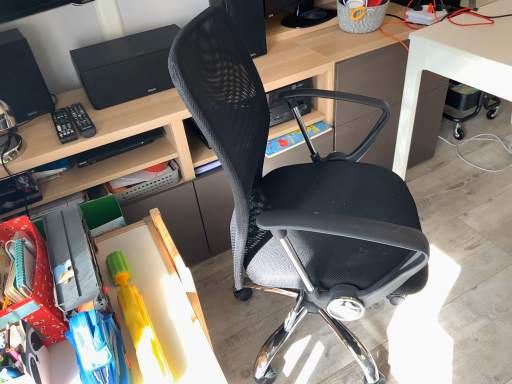
Find the location of a particular element. This screenshot has height=384, width=512. vacant space in white glossy desk at lower right, acting as the 3th desk starting from the left (from a real-world perspective) is located at coordinates (475, 194).